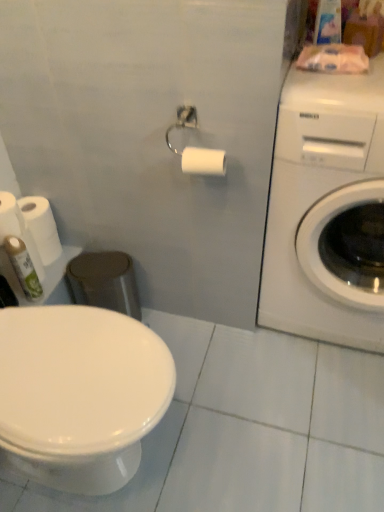
Question: From a real-world perspective, is white glossy washing machine at upper right on white matte toilet paper at left, arranged as the second toilet paper when viewed from the back?

Choices:
 (A) yes
 (B) no

Answer: (A)

Question: Considering the relative sizes of white glossy washing machine at upper right and white matte toilet paper at left, which is counted as the second toilet paper, starting from the left, in the image provided, is white glossy washing machine at upper right wider than white matte toilet paper at left, which is counted as the second toilet paper, starting from the left,?

Choices:
 (A) yes
 (B) no

Answer: (A)

Question: Does white glossy washing machine at upper right turn towards white matte toilet paper at left, acting as the third toilet paper starting from the front?

Choices:
 (A) yes
 (B) no

Answer: (B)

Question: Considering the relative positions of white glossy washing machine at upper right and white matte toilet paper at left, arranged as the second toilet paper when viewed from the back, in the image provided, is white glossy washing machine at upper right to the left of white matte toilet paper at left, arranged as the second toilet paper when viewed from the back, from the viewer's perspective?

Choices:
 (A) no
 (B) yes

Answer: (A)

Question: Is white glossy washing machine at upper right positioned far away from white matte toilet paper at left, which is counted as the second toilet paper, starting from the left?

Choices:
 (A) yes
 (B) no

Answer: (B)

Question: Do you think white matte toilet paper at left, which appears as the third toilet paper when viewed from the back, is within white glossy washing machine at upper right, or outside of it?

Choices:
 (A) outside
 (B) inside

Answer: (A)

Question: Is white matte toilet paper at left, which ranks as the second toilet paper in front-to-back order, taller or shorter than white glossy washing machine at upper right?

Choices:
 (A) tall
 (B) short

Answer: (B)

Question: Considering their positions, is white matte toilet paper at left, which ranks as the second toilet paper in front-to-back order, located in front of or behind white glossy washing machine at upper right?

Choices:
 (A) behind
 (B) front

Answer: (A)

Question: Is white matte toilet paper at left, which is the 1th toilet paper in left-to-right order, wider or thinner than white glossy washing machine at upper right?

Choices:
 (A) thin
 (B) wide

Answer: (A)

Question: From the image's perspective, relative to white matte toilet paper at left, which is counted as the second toilet paper, starting from the left, is green matte spray can at lower left above or below?

Choices:
 (A) above
 (B) below

Answer: (B)

Question: Relative to white matte toilet paper at left, arranged as the second toilet paper when viewed from the back, is green matte spray can at lower left in front or behind?

Choices:
 (A) behind
 (B) front

Answer: (B)

Question: Is green matte spray can at lower left taller or shorter than white matte toilet paper at left, acting as the third toilet paper starting from the front?

Choices:
 (A) tall
 (B) short

Answer: (A)

Question: Visually, is green matte spray can at lower left positioned to the left or to the right of white matte toilet paper at left, which is counted as the second toilet paper, starting from the left?

Choices:
 (A) right
 (B) left

Answer: (A)

Question: Is white glossy toilet at lower left in front of or behind white matte toilet paper at upper center, positioned as the first toilet paper in front-to-back order, in the image?

Choices:
 (A) front
 (B) behind

Answer: (A)

Question: From the image's perspective, is white glossy toilet at lower left above or below white matte toilet paper at upper center, the fourth toilet paper when ordered from back to front?

Choices:
 (A) above
 (B) below

Answer: (B)